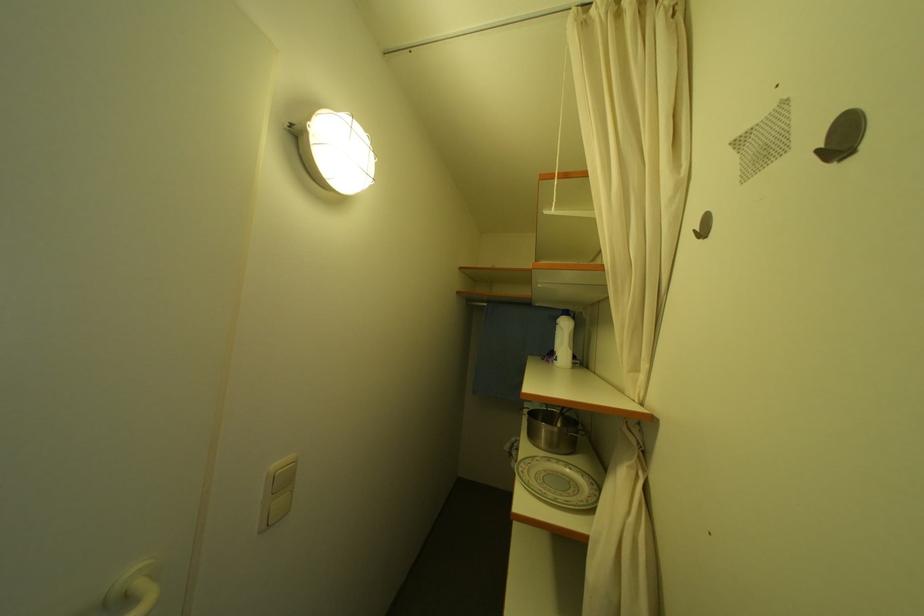
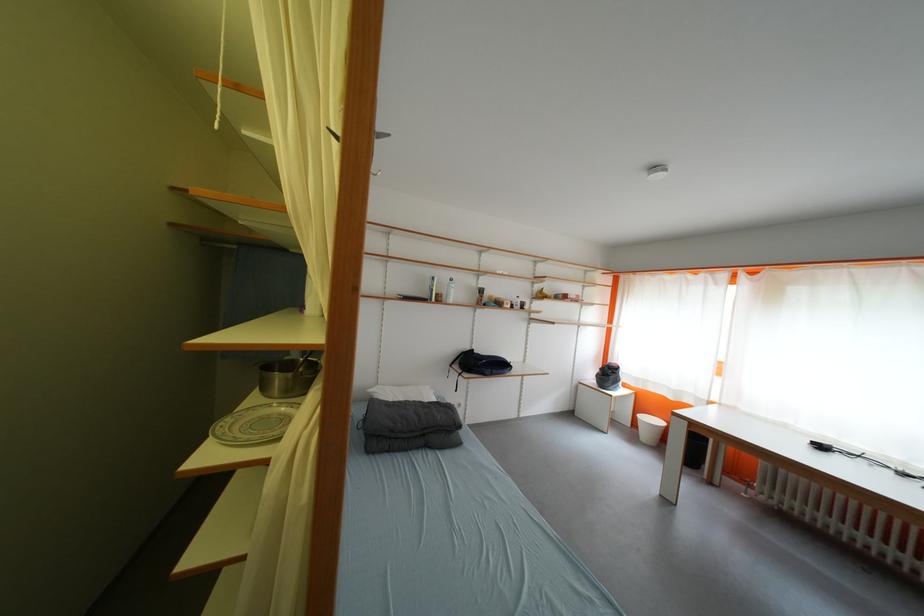
In the second image, find the point that corresponds to the point at 553,432 in the first image.

(286, 382)